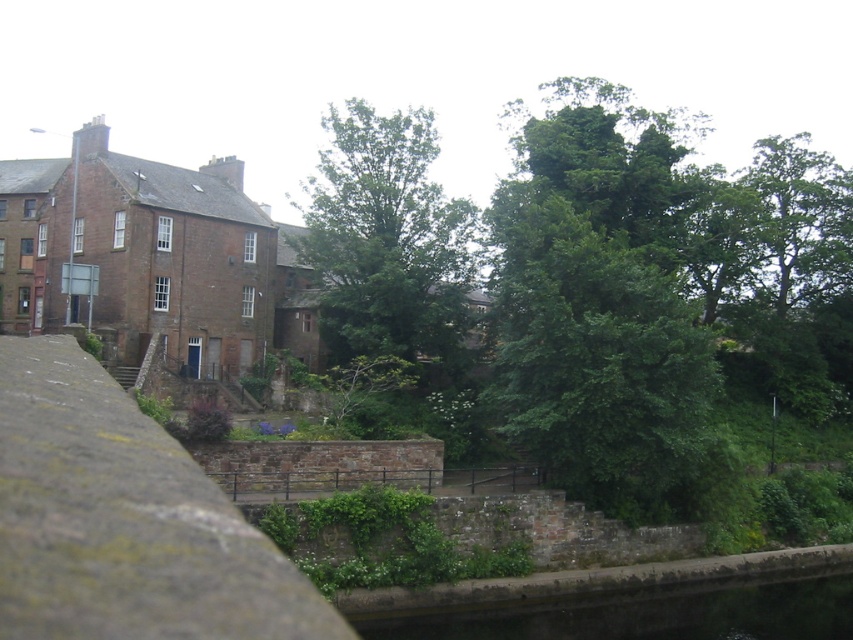
In the scene shown: You are standing at the base of the green leafy tree at center and want to see the green concrete waterway at lower center. Which direction should you look to see it?

The green leafy tree at center is taller than the green concrete waterway at lower center, so you should look downward to see the green concrete waterway at lower center.

You are standing in front of the historic building and want to take a photo. You notice two points marked in the scene. The first point is at coordinate point (345, 182) and the second is at point (743, 618). Which point is closer to your camera lens?

Point (345, 182) is further to the camera than point (743, 618), so the point closer to the camera lens is point (743, 618).

You are standing on the green concrete waterway at lower center and want to walk towards the green leafy tree at center. Which direction should you face?

You should face to the left to walk towards the green leafy tree at center since it is located to the left of the green concrete waterway at lower center.